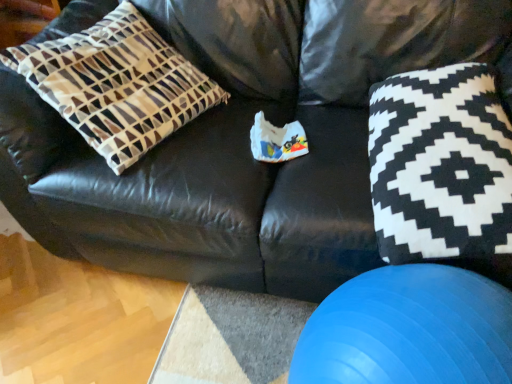
Question: From a real-world perspective, is blue rubber ball at lower right above or below brown and white geometric pillow at left?

Choices:
 (A) below
 (B) above

Answer: (A)

Question: Considering the positions of blue rubber ball at lower right and brown and white geometric pillow at left in the image, is blue rubber ball at lower right wider or thinner than brown and white geometric pillow at left?

Choices:
 (A) wide
 (B) thin

Answer: (B)

Question: Considering the real-world distances, which object is closest to the blue rubber ball at lower right?

Choices:
 (A) black and white fabric pillow at right
 (B) brown and white geometric pillow at left

Answer: (A)

Question: Which is nearer to the black and white fabric pillow at right?

Choices:
 (A) brown and white geometric pillow at left
 (B) blue rubber ball at lower right

Answer: (B)